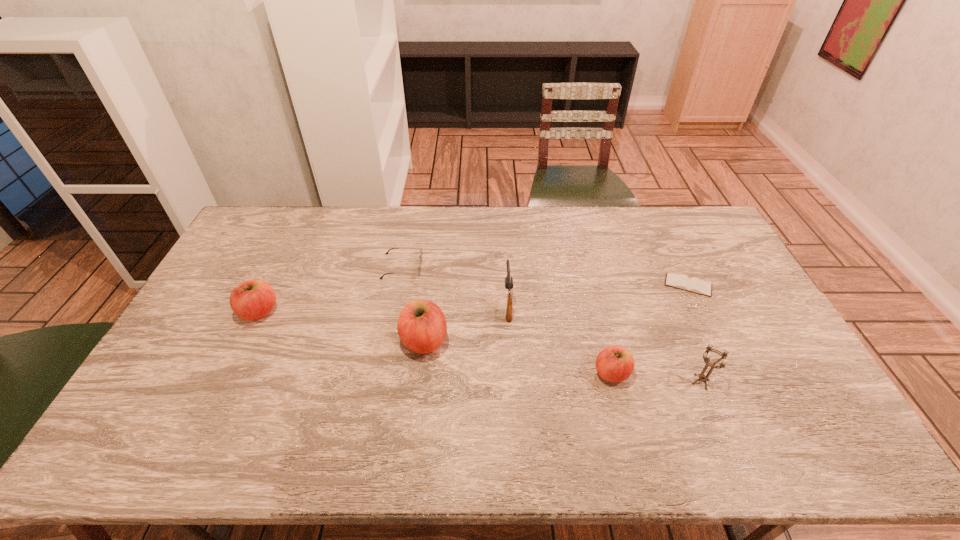
Please point a spot to add another apple on the right. Please provide its 2D coordinates. Your answer should be formatted as a tuple, i.e. [(x, y)], where the tuple contains the x and y coordinates of a point satisfying the conditions above.

[(825, 410)]